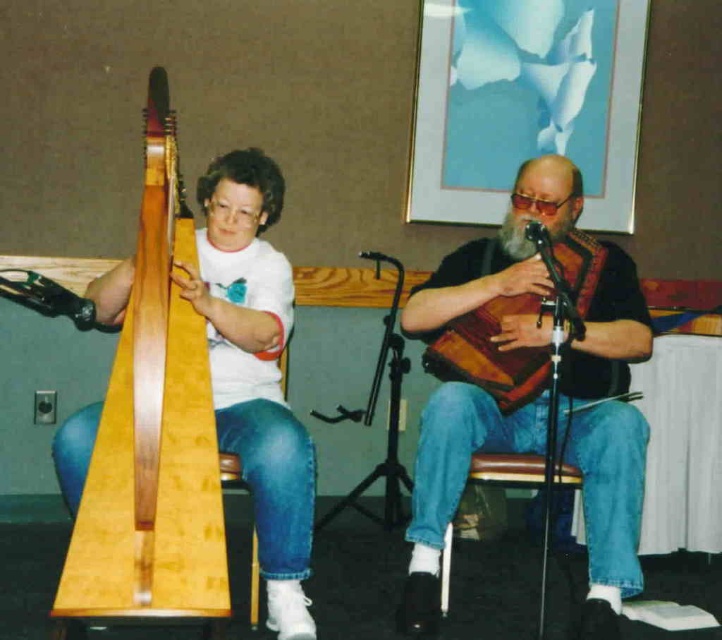
Question: Can you confirm if light brown wood harp at left is positioned below wooden textured bagpipe at center?

Choices:
 (A) yes
 (B) no

Answer: (A)

Question: Is light brown wood harp at left smaller than brown wood stool at lower center?

Choices:
 (A) yes
 (B) no

Answer: (B)

Question: Which point is farther to the camera?

Choices:
 (A) (510, 368)
 (B) (547, 545)
 (C) (129, 515)
 (D) (635, 268)

Answer: (D)

Question: Does brown wooden instrument at center appear over brown wood stool at lower center?

Choices:
 (A) yes
 (B) no

Answer: (A)

Question: Which point appears closest to the camera in this image?

Choices:
 (A) pos(165,572)
 (B) pos(557,474)

Answer: (A)

Question: Among these points, which one is nearest to the camera?

Choices:
 (A) tap(139, 396)
 (B) tap(599, 337)

Answer: (A)